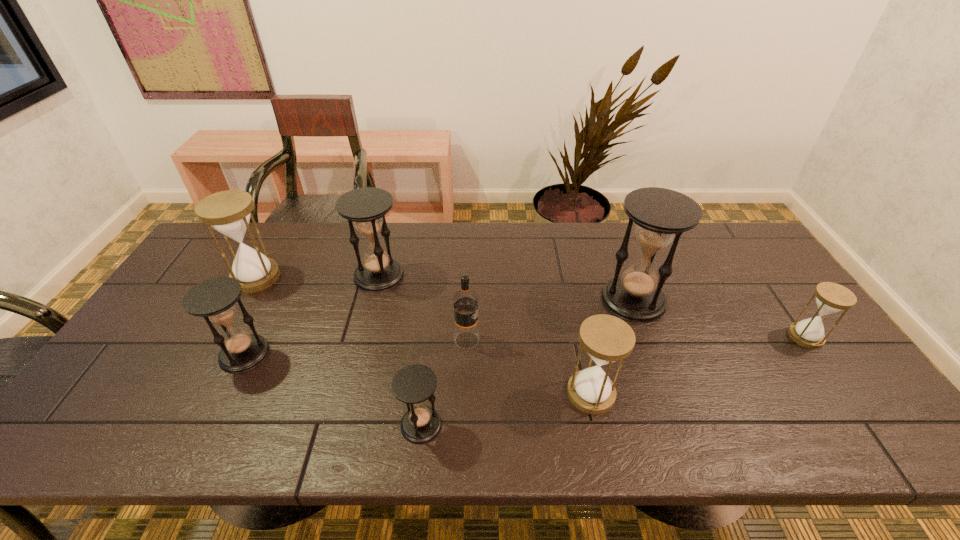
The width and height of the screenshot is (960, 540). I want to click on the nearest white hourglass, so click(x=606, y=338).

Locate an element on the screen. This screenshot has width=960, height=540. the rightmost hourglass is located at coordinates (831, 298).

You are a GUI agent. You are given a task and a screenshot of the screen. Output one action in this format:
    pyautogui.click(x=<x>, y=<y>)
    Task: Click on the smallest white hourglass
    Image resolution: width=960 pixels, height=540 pixels.
    Given the screenshot: What is the action you would take?
    pyautogui.click(x=831, y=298)

In order to click on the nearest black hourglass in this screenshot , I will do `click(414, 384)`.

The height and width of the screenshot is (540, 960). What are the coordinates of `the fourth hourglass from left to right` in the screenshot? It's located at (414, 384).

Find the location of a particular element. free region located on the left of the second hourglass from right to left is located at coordinates (517, 300).

You are a GUI agent. You are given a task and a screenshot of the screen. Output one action in this format:
    pyautogui.click(x=<x>, y=<y>)
    Task: Click on the vacant space located on the front of the fifth hourglass from right to left
    
    Given the screenshot: What is the action you would take?
    pyautogui.click(x=367, y=322)

Find the location of a particular element. This screenshot has width=960, height=540. vacant space located 0.230m on the back of the leftmost white hourglass is located at coordinates (287, 222).

What are the coordinates of `vacant area located 0.150m on the label of the fifth object from left to right` in the screenshot? It's located at (536, 340).

In order to click on vacant space located 0.360m on the right of the second smallest black hourglass in this screenshot , I will do `click(406, 354)`.